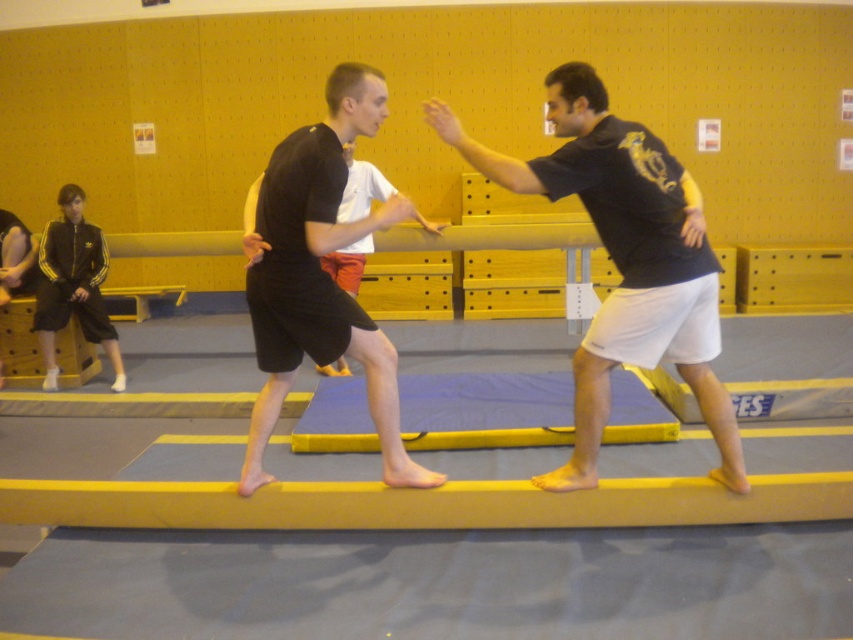
You are a martial arts instructor preparing a training area. You have a yellow foam beam at center and a blue foam mat at center. Which object should you move if you need to create more space for a group exercise that requires a larger open area?

The yellow foam beam at center is smaller than the blue foam mat at center, so you should move the yellow foam beam at center to create more space since it takes up less area and is easier to relocate.

You are a fitness instructor observing a martial arts class. You notice the black matte shorts at center and the blue foam mat at center. Can you determine if the distance between them is sufficient for a 3.5 feet wide exercise equipment to be placed between them?

The distance between the black matte shorts at center and the blue foam mat at center is 4.08 feet, which is greater than the 3.5 feet width of the exercise equipment. Therefore, there is enough space to place the equipment between them.